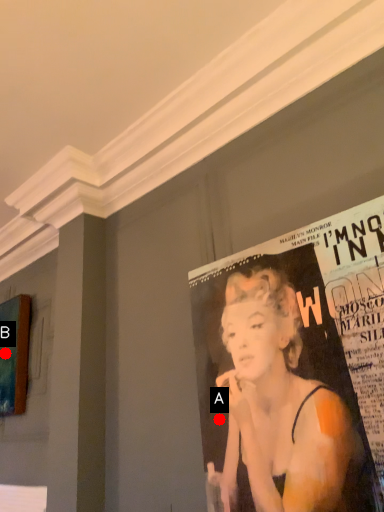
Question: Two points are circled on the image, labeled by A and B beside each circle. Which point appears farthest from the camera in this image?

Choices:
 (A) A is further
 (B) B is further

Answer: (B)